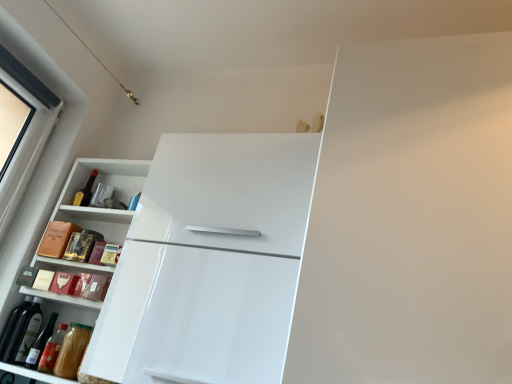
What do you see at coordinates (114, 195) in the screenshot? The height and width of the screenshot is (384, 512). I see `white glossy cabinet at left` at bounding box center [114, 195].

Describe the element at coordinates (41, 343) in the screenshot. The height and width of the screenshot is (384, 512). I see `green glass wine bottle at lower left` at that location.

Describe the element at coordinates (85, 191) in the screenshot. The width and height of the screenshot is (512, 384). I see `matte glass bottle at upper left` at that location.

Locate an element on the screen. This screenshot has height=384, width=512. white glossy refrigerator at upper center is located at coordinates (209, 262).

Considering the positions of objects white glossy cabinet at left and white glossy refrigerator at upper center in the image provided, who is in front, white glossy cabinet at left or white glossy refrigerator at upper center?

white glossy refrigerator at upper center is closer to the camera.

Is white glossy cabinet at left far away from white glossy refrigerator at upper center?

Actually, white glossy cabinet at left and white glossy refrigerator at upper center are a little close together.

Which of these two, white glossy cabinet at left or white glossy refrigerator at upper center, is wider?

white glossy refrigerator at upper center.

From the image's perspective, who appears lower, matte glass bottle at upper left or green glass wine bottle at lower left?

green glass wine bottle at lower left.

Are matte glass bottle at upper left and green glass wine bottle at lower left far apart?

No, matte glass bottle at upper left is not far from green glass wine bottle at lower left.

Is matte glass bottle at upper left taller than green glass wine bottle at lower left?

Yes, matte glass bottle at upper left is taller than green glass wine bottle at lower left.

Which is in front, matte glass bottle at upper left or white glossy refrigerator at upper center?

Positioned in front is white glossy refrigerator at upper center.

Considering the sizes of matte glass bottle at upper left and white glossy refrigerator at upper center in the image, is matte glass bottle at upper left taller or shorter than white glossy refrigerator at upper center?

Clearly, matte glass bottle at upper left is shorter compared to white glossy refrigerator at upper center.

From the image's perspective, is matte glass bottle at upper left located above or below white glossy refrigerator at upper center?

matte glass bottle at upper left is above white glossy refrigerator at upper center.

Measure the distance from matte glass bottle at upper left to white glossy refrigerator at upper center.

matte glass bottle at upper left is 74.80 centimeters away from white glossy refrigerator at upper center.

The image size is (512, 384). What are the coordinates of `bottle that appears on the left of white glossy cabinet at left` in the screenshot? It's located at (85, 191).

Is matte glass bottle at upper left taller than white glossy cabinet at left?

No, matte glass bottle at upper left is not taller than white glossy cabinet at left.

From the image's perspective, does matte glass bottle at upper left appear lower than white glossy cabinet at left?

Actually, matte glass bottle at upper left appears above white glossy cabinet at left in the image.

Is matte glass bottle at upper left to the right of white glossy cabinet at left from the viewer's perspective?

In fact, matte glass bottle at upper left is to the left of white glossy cabinet at left.

From the picture: Is white glossy cabinet at left wider or thinner than matte glass bottle at upper left?

Considering their sizes, white glossy cabinet at left looks broader than matte glass bottle at upper left.

Can you tell me how much white glossy cabinet at left and matte glass bottle at upper left differ in facing direction?

1.61 degrees.

Considering the sizes of objects white glossy cabinet at left and matte glass bottle at upper left in the image provided, who is bigger, white glossy cabinet at left or matte glass bottle at upper left?

Bigger between the two is white glossy cabinet at left.

Is matte glass bottle at upper left surrounded by white glossy cabinet at left?

Yes, matte glass bottle at upper left is a part of white glossy cabinet at left.

Is green glass wine bottle at lower left surrounded by white glossy refrigerator at upper center?

No.

Does white glossy refrigerator at upper center have a larger size compared to green glass wine bottle at lower left?

Yes.

Is white glossy refrigerator at upper center behind green glass wine bottle at lower left?

No, it is not.

Would you say green glass wine bottle at lower left is to the left or to the right of white glossy cabinet at left in the picture?

green glass wine bottle at lower left is to the left of white glossy cabinet at left.

Is green glass wine bottle at lower left far away from white glossy cabinet at left?

That's not correct — green glass wine bottle at lower left is a little close to white glossy cabinet at left.

Which object is closer to the camera taking this photo, green glass wine bottle at lower left or white glossy cabinet at left?

white glossy cabinet at left is in front.

From a real-world perspective, is green glass wine bottle at lower left positioned over white glossy cabinet at left based on gravity?

No, from a real-world perspective, green glass wine bottle at lower left is not above white glossy cabinet at left.

Locate an element on the screen. The height and width of the screenshot is (384, 512). refrigerator on the right of white glossy cabinet at left is located at coordinates (209, 262).

The image size is (512, 384). Identify the location of wine bottle on the left of matte glass bottle at upper left. (41, 343).

From the image, which object appears to be farther from white glossy cabinet at left, matte glass bottle at upper left or green glass wine bottle at lower left?

green glass wine bottle at lower left is positioned further to the anchor white glossy cabinet at left.

Considering their positions, is white glossy cabinet at left positioned further to green glass wine bottle at lower left than matte glass bottle at upper left?

matte glass bottle at upper left is further to green glass wine bottle at lower left.

Estimate the real-world distances between objects in this image. Which object is further from matte glass bottle at upper left, white glossy refrigerator at upper center or white glossy cabinet at left?

white glossy refrigerator at upper center lies further to matte glass bottle at upper left than the other object.

Considering their positions, is green glass wine bottle at lower left positioned closer to matte glass bottle at upper left than white glossy cabinet at left?

Among the two, white glossy cabinet at left is located nearer to matte glass bottle at upper left.

Based on the photo, when comparing their distances from white glossy refrigerator at upper center, does matte glass bottle at upper left or green glass wine bottle at lower left seem closer?

green glass wine bottle at lower left is closer to white glossy refrigerator at upper center.

Which object lies further to the anchor point white glossy cabinet at left, matte glass bottle at upper left or white glossy refrigerator at upper center?

white glossy refrigerator at upper center lies further to white glossy cabinet at left than the other object.

Based on the photo, when comparing their distances from green glass wine bottle at lower left, does white glossy refrigerator at upper center or matte glass bottle at upper left seem closer?

Among the two, matte glass bottle at upper left is located nearer to green glass wine bottle at lower left.

Which object lies nearer to the anchor point white glossy refrigerator at upper center, matte glass bottle at upper left or white glossy cabinet at left?

Among the two, white glossy cabinet at left is located nearer to white glossy refrigerator at upper center.

In order to click on wine bottle located between white glossy refrigerator at upper center and matte glass bottle at upper left in the depth direction in this screenshot , I will do `click(41, 343)`.

Find the location of a particular element. cabinetry between green glass wine bottle at lower left and white glossy refrigerator at upper center is located at coordinates pos(114,195).

Locate an element on the screen. cabinetry between white glossy refrigerator at upper center and matte glass bottle at upper left in the front-back direction is located at coordinates (114, 195).

Find the location of a particular element. The height and width of the screenshot is (384, 512). wine bottle between white glossy cabinet at left and matte glass bottle at upper left from front to back is located at coordinates (41, 343).